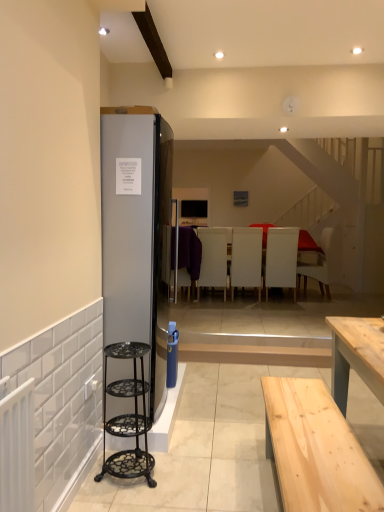
Question: Does point (304, 294) appear closer or farther from the camera than point (168, 262)?

Choices:
 (A) closer
 (B) farther

Answer: (B)

Question: Considering the positions of white fabric armchair at center, which is counted as the fifth armchair, starting from the left, and satin silver refrigerator at left in the image, is white fabric armchair at center, which is counted as the fifth armchair, starting from the left, taller or shorter than satin silver refrigerator at left?

Choices:
 (A) short
 (B) tall

Answer: (A)

Question: Which object is positioned closest to the white leather armchair at center, which is the fourth armchair in right-to-left order?

Choices:
 (A) black wrought iron step stool at left
 (B) white fabric armchair at center, which is counted as the fifth armchair, starting from the left
 (C) purple fabric armchair at center, arranged as the fifth armchair when viewed from the right
 (D) satin silver refrigerator at left
 (E) white leather armchair at center, the second armchair positioned from the right

Answer: (C)

Question: Which object is positioned farthest from the white leather armchair at center, which appears as the fourth armchair when viewed from the left?

Choices:
 (A) satin silver refrigerator at left
 (B) purple fabric armchair at center, the first armchair viewed from the left
 (C) white leather armchair at center, the 2th armchair from the left
 (D) white fabric armchair at center, the 1th armchair when ordered from right to left
 (E) black wrought iron step stool at left

Answer: (E)